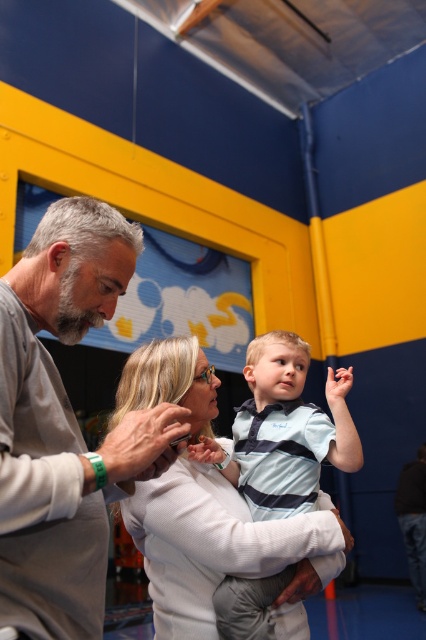
Question: Is the position of gray matte shirt at center more distant than that of white textured shirt at center?

Choices:
 (A) yes
 (B) no

Answer: (B)

Question: Can you confirm if gray matte shirt at center is positioned above white textured shirt at center?

Choices:
 (A) yes
 (B) no

Answer: (A)

Question: Which object appears farthest from the camera in this image?

Choices:
 (A) white textured shirt at center
 (B) gray matte shirt at center

Answer: (A)

Question: Does gray matte shirt at center have a greater width compared to white textured shirt at center?

Choices:
 (A) no
 (B) yes

Answer: (A)

Question: Which point is farther to the camera?

Choices:
 (A) (123, 438)
 (B) (176, 396)

Answer: (B)